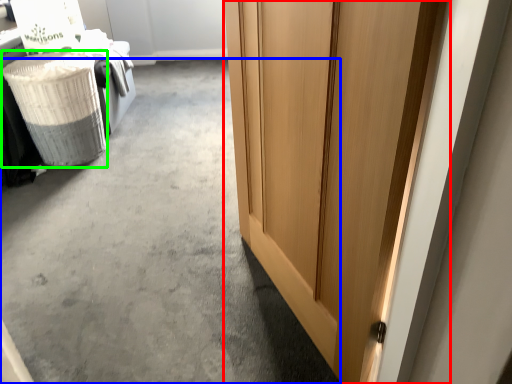
Question: Based on their relative distances, which object is farther from door (highlighted by a red box)? Choose from concrete (highlighted by a blue box) and laundry basket (highlighted by a green box).

Choices:
 (A) concrete
 (B) laundry basket

Answer: (B)